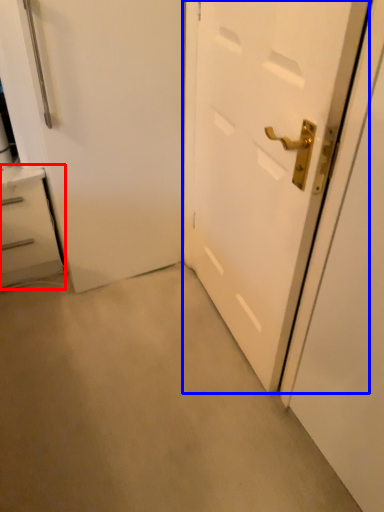
Question: Which of the following is the farthest to the observer, chest of drawers (highlighted by a red box) or door (highlighted by a blue box)?

Choices:
 (A) chest of drawers
 (B) door

Answer: (A)